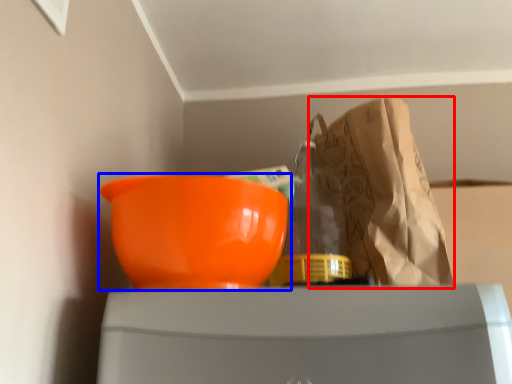
Question: Which object appears farthest to the camera in this image, grocery bag (highlighted by a red box) or bowl (highlighted by a blue box)?

Choices:
 (A) grocery bag
 (B) bowl

Answer: (A)